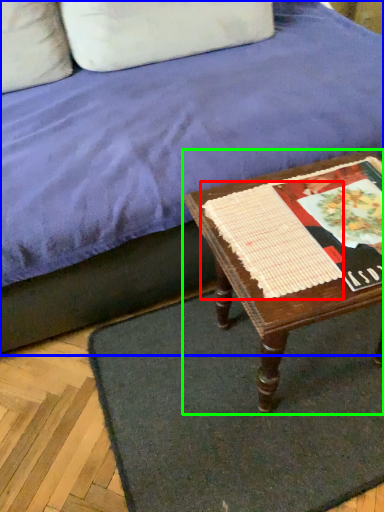
Question: Which object is positioned closest to linen (highlighted by a red box)? Select from studio couch (highlighted by a blue box) and table (highlighted by a green box).

Choices:
 (A) studio couch
 (B) table

Answer: (B)